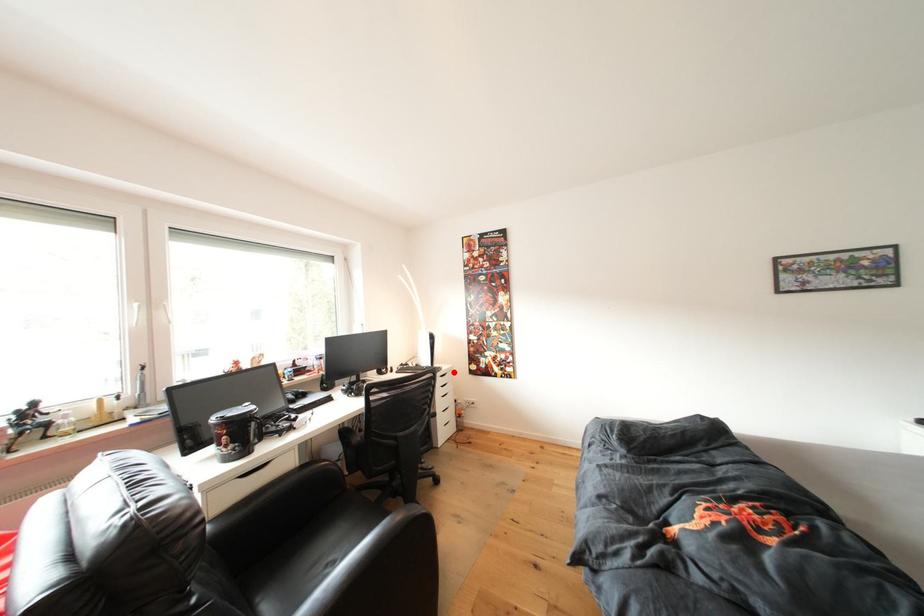
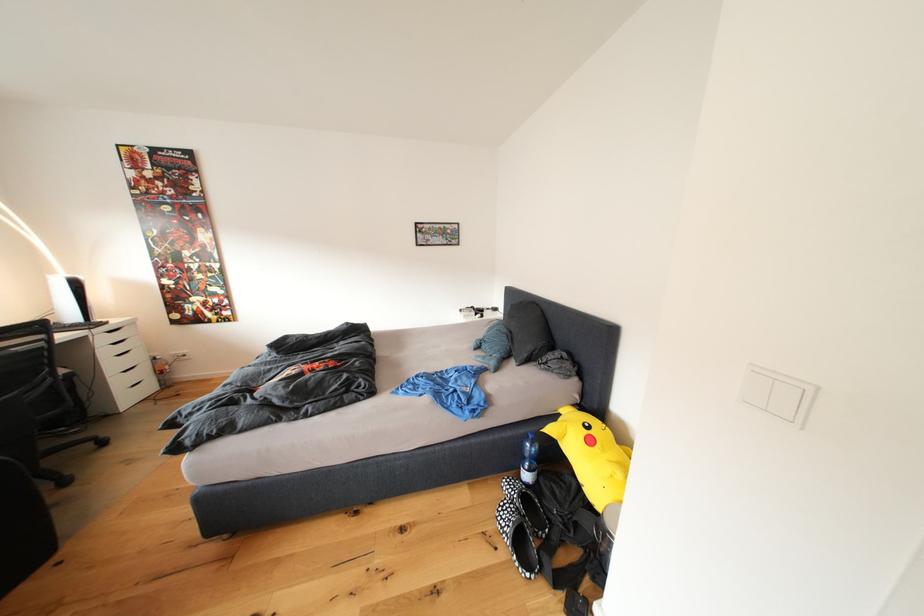
Where in the second image is the point corresponding to the highlighted location from the first image?

(125, 326)